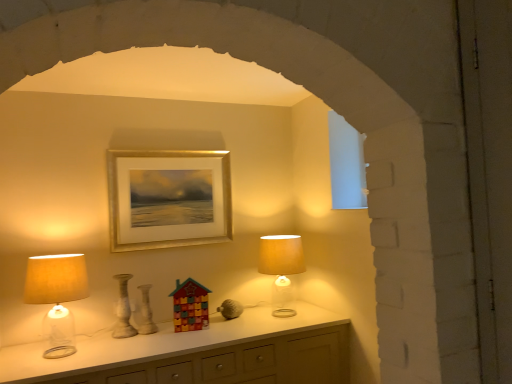
The width and height of the screenshot is (512, 384). I want to click on blank space situated above gold metallic picture frame at upper center (from a real-world perspective), so click(166, 153).